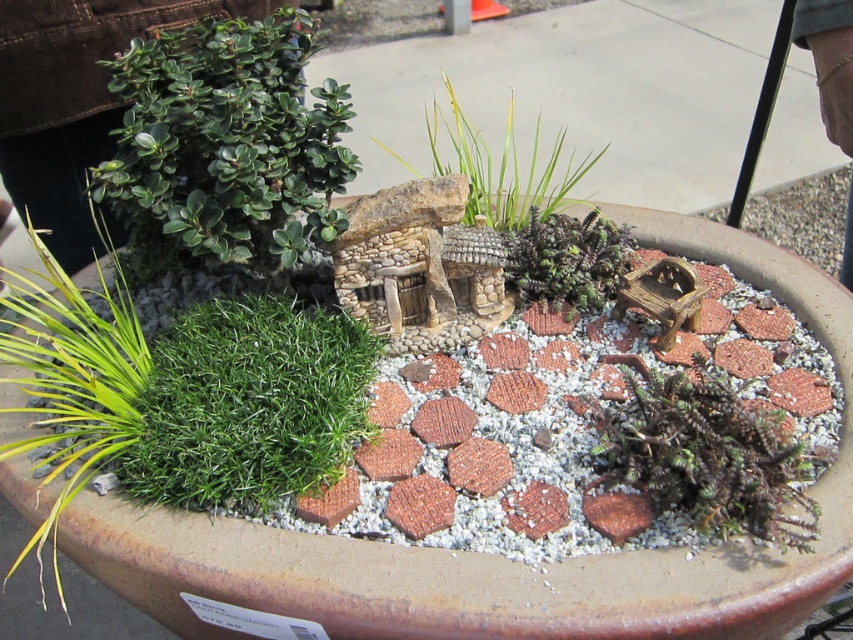
Does point (142, 573) come closer to viewer compared to point (476, 189)?

Yes, point (142, 573) is in front of point (476, 189).

Does rustic stone bird bath at center come in front of green grass at center?

Yes, it is.

Does point (154, 531) come behind point (451, 148)?

No, (154, 531) is closer to viewer.

Find the location of `rustic stone bird bath at center`. rustic stone bird bath at center is located at coordinates (491, 554).

Is green matte plant at upper left taller than green grass at center?

No, green matte plant at upper left is not taller than green grass at center.

Is green matte plant at upper left wider than green grass at center?

No.

Does point (161, 109) come closer to viewer compared to point (525, 212)?

Yes.

At what (x,y) coordinates should I click in order to perform the action: click on green matte plant at upper left. Please return your answer as a coordinate pair (x, y). This screenshot has height=640, width=853. Looking at the image, I should click on (225, 145).

Is point (332, 344) positioned behind point (293, 42)?

No, (332, 344) is in front of (293, 42).

Who is more forward, (80,419) or (297,232)?

Point (80,419) is more forward.

You are a GUI agent. You are given a task and a screenshot of the screen. Output one action in this format:
    pyautogui.click(x=<x>, y=<y>)
    Task: Click on the green grass at upper left
    The width and height of the screenshot is (853, 640).
    Given the screenshot: What is the action you would take?
    pyautogui.click(x=183, y=396)